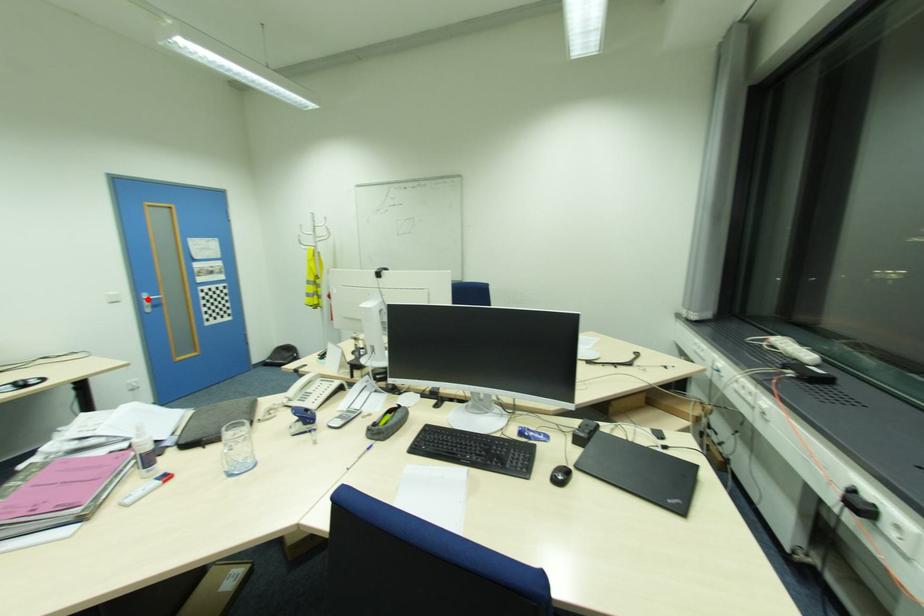
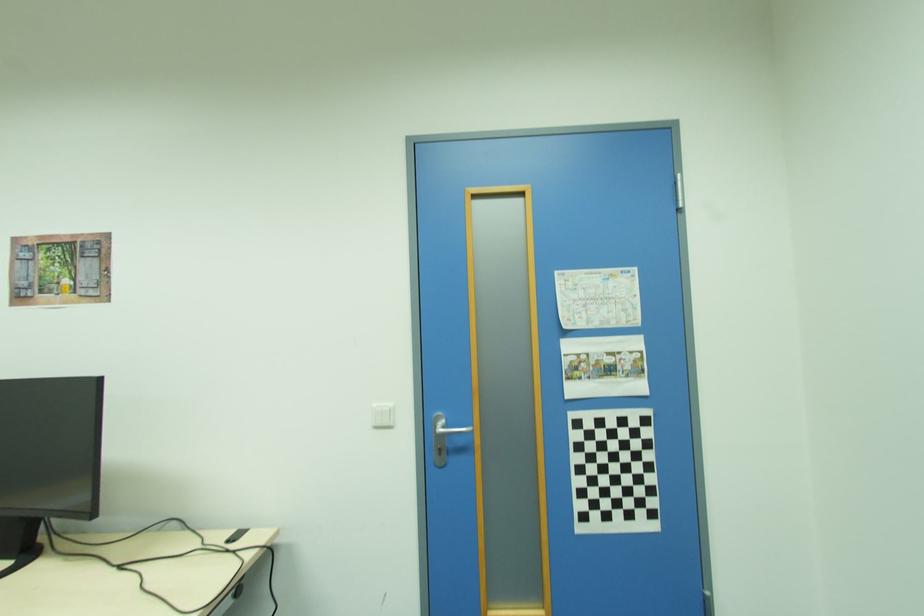
Where in the second image is the point corresponding to the highlighted location from the first image?

(439, 429)